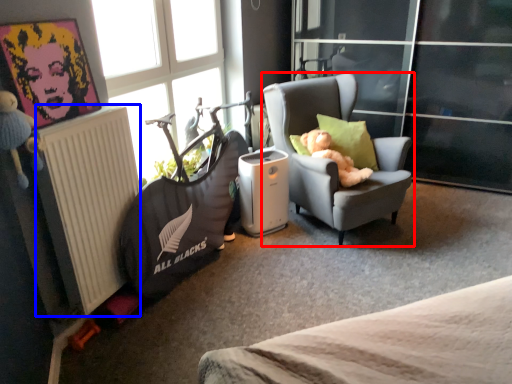
Question: Which of the following is the farthest to the observer, chair (highlighted by a red box) or radiator (highlighted by a blue box)?

Choices:
 (A) chair
 (B) radiator

Answer: (A)